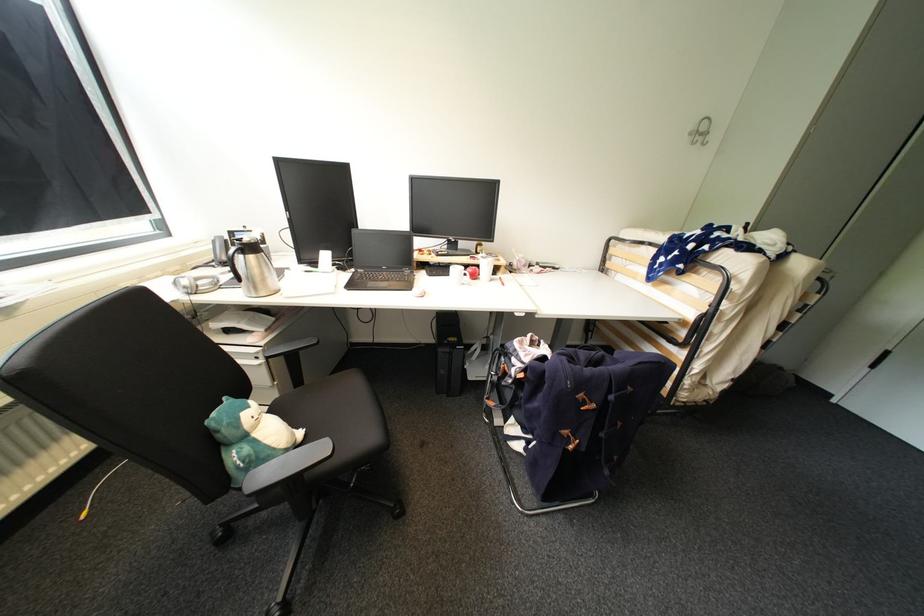
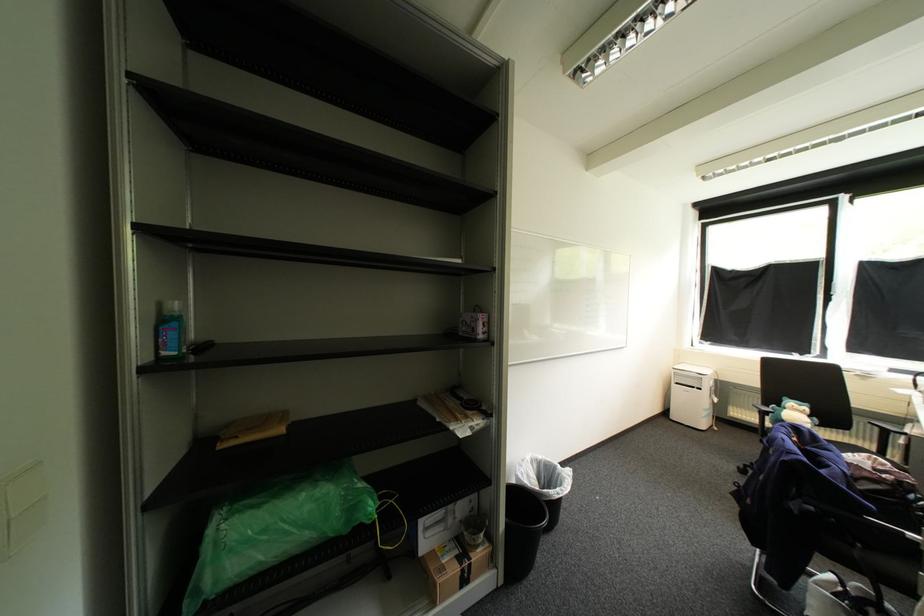
Locate, in the second image, the point that corresponds to (251,438) in the first image.

(792, 408)